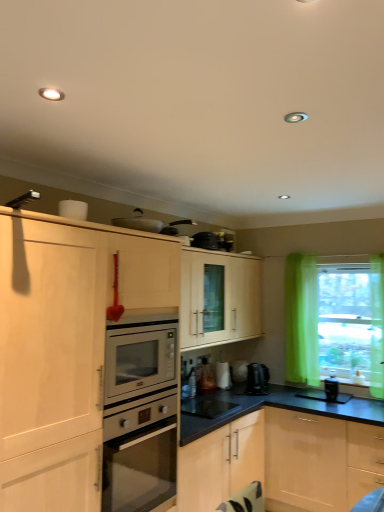
Question: From the image's perspective, does black plastic coffee maker at lower right, the 3th appliance positioned from the top, appear higher than translucent green curtain at right?

Choices:
 (A) yes
 (B) no

Answer: (B)

Question: Is black plastic coffee maker at lower right, the 3th appliance positioned from the top, turned away from translucent green curtain at right?

Choices:
 (A) no
 (B) yes

Answer: (A)

Question: Is black plastic coffee maker at lower right, placed as the second appliance when sorted from bottom to top, smaller than translucent green curtain at right?

Choices:
 (A) yes
 (B) no

Answer: (A)

Question: Is black plastic coffee maker at lower right, which is the fourth appliance in left-to-right order, positioned in front of translucent green curtain at right?

Choices:
 (A) yes
 (B) no

Answer: (A)

Question: Can you confirm if black plastic coffee maker at lower right, the 3th appliance positioned from the top, is taller than translucent green curtain at right?

Choices:
 (A) yes
 (B) no

Answer: (B)

Question: From the image's perspective, is satin black coffee machine at lower center positioned above or below black plastic coffee maker at lower right, which is the fourth appliance in left-to-right order?

Choices:
 (A) below
 (B) above

Answer: (B)

Question: Considering the positions of satin black coffee machine at lower center and black plastic coffee maker at lower right, the 2th appliance in the back-to-front sequence, in the image, is satin black coffee machine at lower center taller or shorter than black plastic coffee maker at lower right, the 2th appliance in the back-to-front sequence,?

Choices:
 (A) short
 (B) tall

Answer: (B)

Question: Is satin black coffee machine at lower center in front of or behind black plastic coffee maker at lower right, arranged as the 1th appliance when viewed from the right, in the image?

Choices:
 (A) front
 (B) behind

Answer: (B)

Question: Considering the relative positions of satin black coffee machine at lower center and black plastic coffee maker at lower right, which is the fourth appliance in left-to-right order, in the image provided, is satin black coffee machine at lower center to the left or to the right of black plastic coffee maker at lower right, which is the fourth appliance in left-to-right order,?

Choices:
 (A) right
 (B) left

Answer: (B)

Question: Does point (150, 224) appear closer or farther from the camera than point (334, 376)?

Choices:
 (A) farther
 (B) closer

Answer: (B)

Question: Considering the positions of metallic silver toaster at upper center, the first appliance when ordered from top to bottom, and black plastic coffee maker at lower right, acting as the 3th appliance starting from the front, in the image, is metallic silver toaster at upper center, the first appliance when ordered from top to bottom, taller or shorter than black plastic coffee maker at lower right, acting as the 3th appliance starting from the front,?

Choices:
 (A) short
 (B) tall

Answer: (A)

Question: Which is correct: metallic silver toaster at upper center, the first appliance viewed from the front, is inside black plastic coffee maker at lower right, placed as the second appliance when sorted from bottom to top, or outside of it?

Choices:
 (A) outside
 (B) inside

Answer: (A)

Question: Would you say metallic silver toaster at upper center, the 4th appliance positioned from the bottom, is to the left or to the right of black plastic coffee maker at lower right, which is the fourth appliance in left-to-right order, in the picture?

Choices:
 (A) right
 (B) left

Answer: (B)

Question: From a real-world perspective, relative to black plastic coffee maker at lower right, which is the fourth appliance in left-to-right order, is translucent green curtain at right vertically above or below?

Choices:
 (A) below
 (B) above

Answer: (B)

Question: Is translucent green curtain at right taller or shorter than black plastic coffee maker at lower right, which is the fourth appliance in left-to-right order?

Choices:
 (A) short
 (B) tall

Answer: (B)